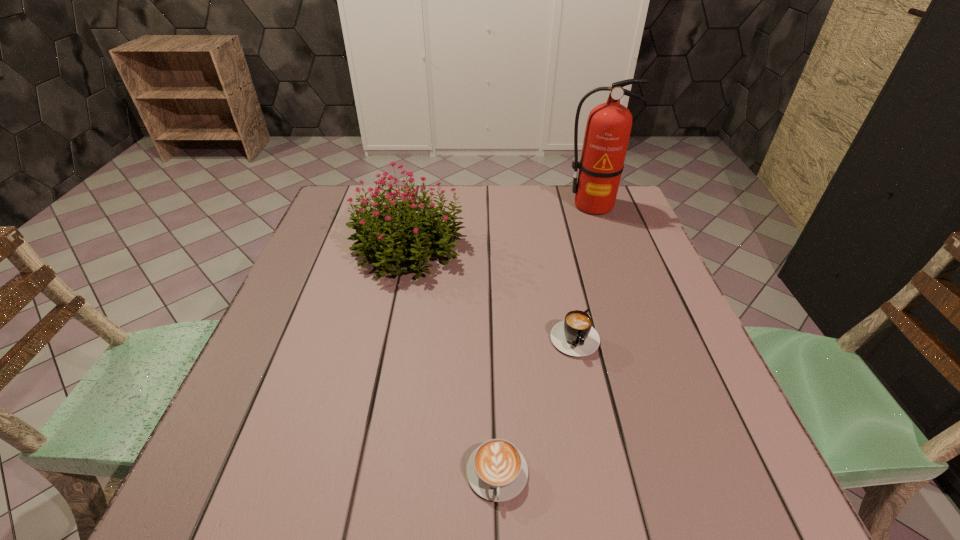
Locate an element on the screen. This screenshot has height=540, width=960. free space between the bouquet and the tallest object is located at coordinates (501, 226).

Find the location of `free space between the nearest object and the second tallest object`. free space between the nearest object and the second tallest object is located at coordinates (453, 360).

Find the location of a particular element. This screenshot has width=960, height=540. object that is the second closest to the tallest object is located at coordinates (575, 336).

Locate an element on the screen. object that is the second closest to the fire extinguisher is located at coordinates click(575, 336).